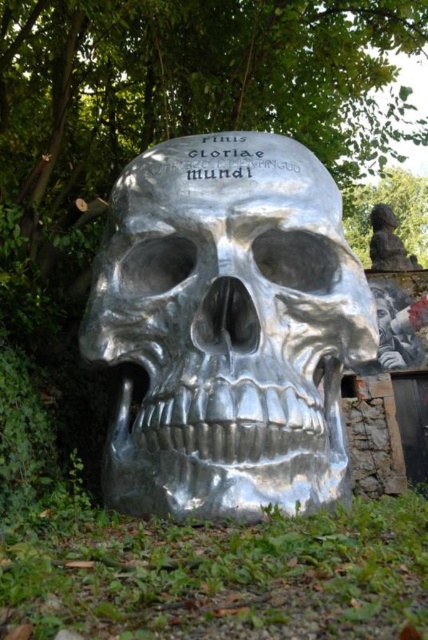
Consider the image. You are an art critic analyzing the sculpture installation. You notice the green leafy tree at upper center and the satin silver skull at center. Which object occupies a more prominent visual space in the composition?

The green leafy tree at upper center has a larger size compared to the satin silver skull at center, making it occupy a more prominent visual space in the composition.

You are an art curator planning to display both the shiny metallic skull at center and the satin silver skull at center in a gallery. If you want to place them side by side on a shelf, which one should be placed first to ensure the smaller one doesn

The satin silver skull at center should be placed first since it is smaller than the shiny metallic skull at center, allowing enough space for both on the shelf.